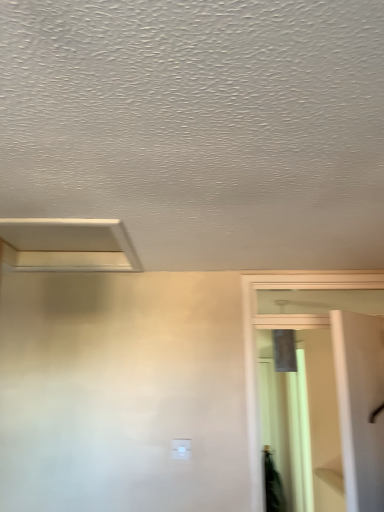
Question: Considering the relative sizes of white plastic light switch at center and white matte exhaust hood at upper left in the image provided, is white plastic light switch at center wider than white matte exhaust hood at upper left?

Choices:
 (A) yes
 (B) no

Answer: (B)

Question: Is white plastic light switch at center positioned behind white matte exhaust hood at upper left?

Choices:
 (A) yes
 (B) no

Answer: (A)

Question: From a real-world perspective, is white plastic light switch at center physically above white matte exhaust hood at upper left?

Choices:
 (A) yes
 (B) no

Answer: (B)

Question: From a real-world perspective, does white plastic light switch at center sit lower than white matte exhaust hood at upper left?

Choices:
 (A) yes
 (B) no

Answer: (A)

Question: Is white plastic light switch at center to the left of white matte exhaust hood at upper left from the viewer's perspective?

Choices:
 (A) yes
 (B) no

Answer: (B)

Question: From the image's perspective, is white plastic light switch at center above or below white matte exhaust hood at upper left?

Choices:
 (A) above
 (B) below

Answer: (B)

Question: In terms of width, does white plastic light switch at center look wider or thinner when compared to white matte exhaust hood at upper left?

Choices:
 (A) wide
 (B) thin

Answer: (B)

Question: Considering their positions, is white plastic light switch at center located in front of or behind white matte exhaust hood at upper left?

Choices:
 (A) behind
 (B) front

Answer: (A)

Question: Based on their sizes in the image, would you say white plastic light switch at center is bigger or smaller than white matte exhaust hood at upper left?

Choices:
 (A) small
 (B) big

Answer: (A)

Question: In terms of size, does white plastic light switch at center appear bigger or smaller than clear glass screen door at right?

Choices:
 (A) small
 (B) big

Answer: (A)

Question: Which is correct: white plastic light switch at center is inside clear glass screen door at right, or outside of it?

Choices:
 (A) outside
 (B) inside

Answer: (A)

Question: From the image's perspective, is white plastic light switch at center located above or below clear glass screen door at right?

Choices:
 (A) above
 (B) below

Answer: (B)

Question: In the image, is white plastic light switch at center on the left side or the right side of clear glass screen door at right?

Choices:
 (A) left
 (B) right

Answer: (A)

Question: Considering the positions of clear glass screen door at right and white matte exhaust hood at upper left in the image, is clear glass screen door at right bigger or smaller than white matte exhaust hood at upper left?

Choices:
 (A) small
 (B) big

Answer: (B)

Question: In terms of width, does clear glass screen door at right look wider or thinner when compared to white matte exhaust hood at upper left?

Choices:
 (A) thin
 (B) wide

Answer: (A)